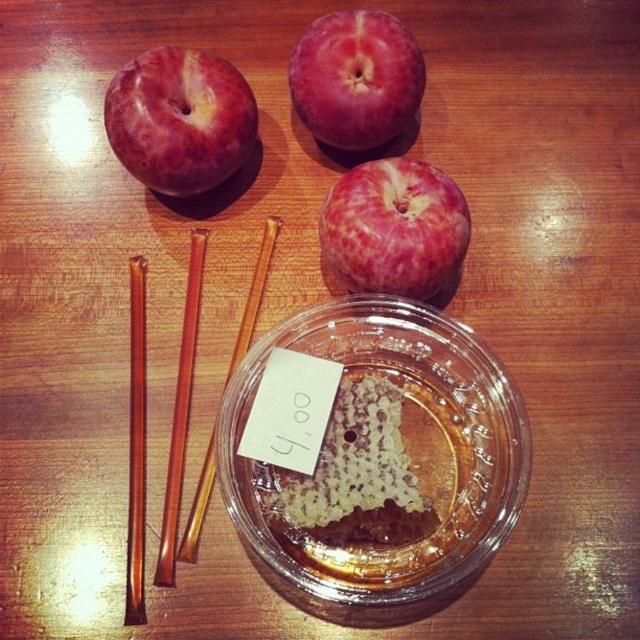
Who is positioned more to the right, matte red apple at upper left or shiny red apple at upper center?

shiny red apple at upper center

Which is behind, point (140, 104) or point (317, 22)?

The point (317, 22) is more distant.

Locate an element on the screen. Image resolution: width=640 pixels, height=640 pixels. matte red apple at upper left is located at coordinates (179, 120).

Who is taller, pink matte apple at center or brown wood chopstick at upper left?

brown wood chopstick at upper left is taller.

You are a GUI agent. You are given a task and a screenshot of the screen. Output one action in this format:
    pyautogui.click(x=<x>, y=<y>)
    Task: Click on the pink matte apple at center
    Image resolution: width=640 pixels, height=640 pixels.
    Given the screenshot: What is the action you would take?
    pyautogui.click(x=394, y=228)

Find the location of a particular element. pink matte apple at center is located at coordinates (394, 228).

Is translucent honeycomb at center bigger than translucent amber glass chopstick at upper center?

Incorrect, translucent honeycomb at center is not larger than translucent amber glass chopstick at upper center.

Which is more to the left, translucent honeycomb at center or translucent amber glass chopstick at upper center?

translucent amber glass chopstick at upper center is more to the left.

Is point (276, 502) farther from camera compared to point (237, 346)?

No.

The image size is (640, 640). I want to click on translucent honeycomb at center, so click(x=356, y=474).